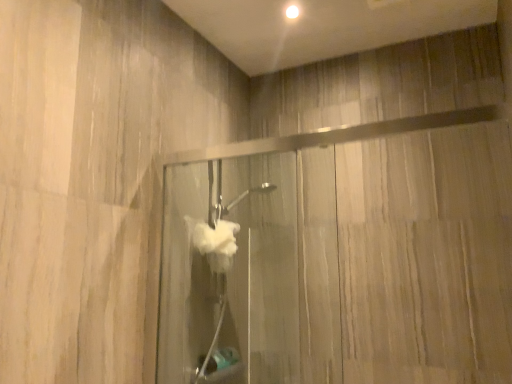
The image size is (512, 384). What do you see at coordinates (342, 255) in the screenshot?
I see `transparent glass door at upper right` at bounding box center [342, 255].

This screenshot has height=384, width=512. Identify the location of transparent glass door at upper right. pyautogui.click(x=342, y=255).

What do you see at coordinates (230, 270) in the screenshot? I see `translucent glass shower door at center` at bounding box center [230, 270].

Locate an element on the screen. This screenshot has height=384, width=512. translucent glass shower door at center is located at coordinates (230, 270).

At what (x,y) coordinates should I click in order to perform the action: click on transparent glass door at upper right. Please return your answer as a coordinate pair (x, y). The width and height of the screenshot is (512, 384). Looking at the image, I should click on pos(342,255).

Is transparent glass door at upper right to the left or to the right of translucent glass shower door at center in the image?

In the image, transparent glass door at upper right appears on the right side of translucent glass shower door at center.

In the image, is transparent glass door at upper right positioned in front of or behind translucent glass shower door at center?

transparent glass door at upper right is in front of translucent glass shower door at center.

Is point (184, 220) behind point (268, 336)?

No.

From the image's perspective, is transparent glass door at upper right located above or below translucent glass shower door at center?

transparent glass door at upper right is situated higher than translucent glass shower door at center in the image.

From a real-world perspective, is transparent glass door at upper right under translucent glass shower door at center?

No, from a real-world perspective, transparent glass door at upper right is not beneath translucent glass shower door at center.

Considering the sizes of transparent glass door at upper right and translucent glass shower door at center in the image, is transparent glass door at upper right wider or thinner than translucent glass shower door at center?

Considering their sizes, transparent glass door at upper right looks slimmer than translucent glass shower door at center.

Considering the sizes of transparent glass door at upper right and translucent glass shower door at center in the image, is transparent glass door at upper right taller or shorter than translucent glass shower door at center?

In the image, transparent glass door at upper right appears to be shorter than translucent glass shower door at center.

Is transparent glass door at upper right bigger or smaller than translucent glass shower door at center?

In the image, transparent glass door at upper right appears to be smaller than translucent glass shower door at center.

Would you say translucent glass shower door at center is part of transparent glass door at upper right's contents?

Actually, translucent glass shower door at center is outside transparent glass door at upper right.

Are transparent glass door at upper right and translucent glass shower door at center located far from each other?

transparent glass door at upper right is actually quite close to translucent glass shower door at center.

Is transparent glass door at upper right looking in the opposite direction of translucent glass shower door at center?

No, translucent glass shower door at center is not at the back of transparent glass door at upper right.

How different are the orientations of transparent glass door at upper right and translucent glass shower door at center in degrees?

There is a 88.4-degree angle between the facing directions of transparent glass door at upper right and translucent glass shower door at center.

Could you measure the distance between transparent glass door at upper right and translucent glass shower door at center?

They are 13.91 centimeters apart.

Find the location of a particular element. The height and width of the screenshot is (384, 512). glass door that appears above the translucent glass shower door at center (from the image's perspective) is located at coordinates (342, 255).

Can you confirm if translucent glass shower door at center is positioned to the right of transparent glass door at upper right?

In fact, translucent glass shower door at center is to the left of transparent glass door at upper right.

Is the position of translucent glass shower door at center more distant than that of transparent glass door at upper right?

Yes, translucent glass shower door at center is further from the camera.

Does point (270, 172) come behind point (316, 187)?

Yes, point (270, 172) is behind point (316, 187).

From the image's perspective, does translucent glass shower door at center appear lower than transparent glass door at upper right?

Yes.

From a real-world perspective, who is located higher, translucent glass shower door at center or transparent glass door at upper right?

transparent glass door at upper right is physically above.

Can you confirm if translucent glass shower door at center is thinner than transparent glass door at upper right?

No.

Is translucent glass shower door at center taller than transparent glass door at upper right?

Indeed, translucent glass shower door at center has a greater height compared to transparent glass door at upper right.

Can you confirm if translucent glass shower door at center is bigger than transparent glass door at upper right?

Indeed, translucent glass shower door at center has a larger size compared to transparent glass door at upper right.

Do you think translucent glass shower door at center is within transparent glass door at upper right, or outside of it?

translucent glass shower door at center is spatially situated outside transparent glass door at upper right.

Consider the image. Are translucent glass shower door at center and transparent glass door at upper right located far from each other?

No, translucent glass shower door at center is not far from transparent glass door at upper right.

Is translucent glass shower door at center oriented towards transparent glass door at upper right?

No, translucent glass shower door at center is not oriented towards transparent glass door at upper right.

How much distance is there between translucent glass shower door at center and transparent glass door at upper right?

translucent glass shower door at center is 13.91 centimeters away from transparent glass door at upper right.

What are the coordinates of `glass door above the translucent glass shower door at center (from a real-world perspective)` in the screenshot? It's located at (342, 255).

Where is `glass door lying above the translucent glass shower door at center (from the image's perspective)`? The height and width of the screenshot is (384, 512). glass door lying above the translucent glass shower door at center (from the image's perspective) is located at coordinates (342, 255).

The height and width of the screenshot is (384, 512). What are the coordinates of `glass door above the translucent glass shower door at center (from a real-world perspective)` in the screenshot? It's located at (342, 255).